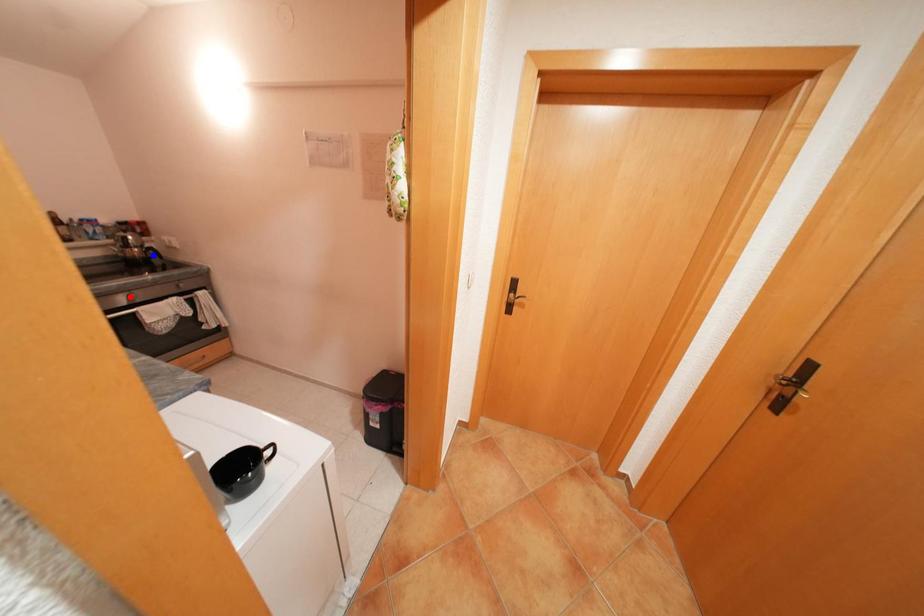
Question: Two points are marked on the image. Which point is closer to the camera?

Choices:
 (A) Blue point is closer.
 (B) Red point is closer.

Answer: (B)